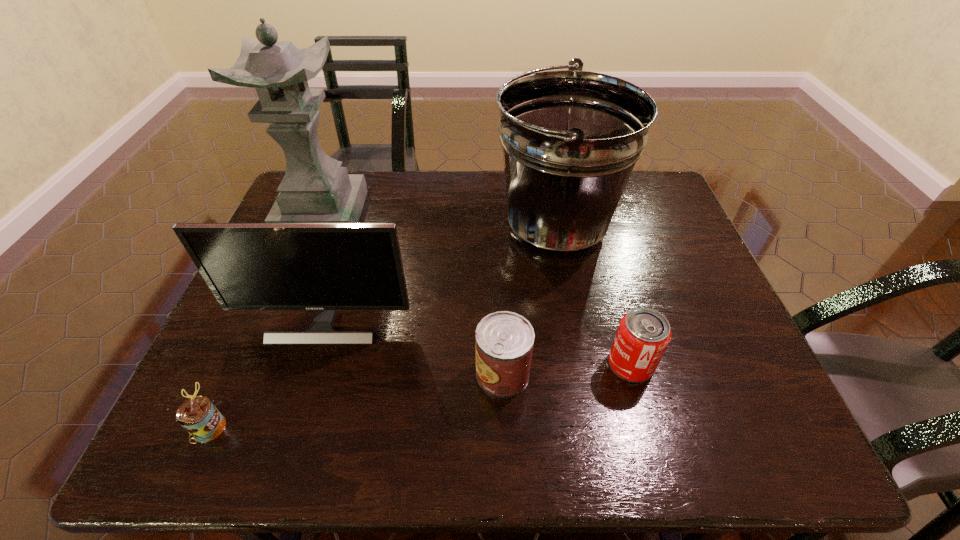
Find the location of a particular element. This screenshot has width=960, height=540. free region located on the screen side of the third tallest object is located at coordinates (301, 395).

The image size is (960, 540). I want to click on vacant space located on the back of the rightmost can, so click(x=603, y=263).

This screenshot has width=960, height=540. In order to click on vacant area located 0.390m on the back of the second can from right to left in this screenshot , I will do `click(497, 238)`.

Where is `vacant area situated on the back of the shortest can`? vacant area situated on the back of the shortest can is located at coordinates (247, 342).

At what (x,y) coordinates should I click in order to perform the action: click on sculpture that is at the far edge. Please return your answer as a coordinate pair (x, y). Looking at the image, I should click on (315, 189).

Identify the location of bucket that is at the far edge. (570, 138).

You are a GUI agent. You are given a task and a screenshot of the screen. Output one action in this format:
    pyautogui.click(x=<x>, y=<y>)
    Task: Click on the object present at the near edge
    
    Given the screenshot: What is the action you would take?
    pyautogui.click(x=198, y=416)

The height and width of the screenshot is (540, 960). Find the location of `sculpture located in the left edge section of the desktop`. sculpture located in the left edge section of the desktop is located at coordinates (315, 189).

Where is `monitor located at the left edge`? monitor located at the left edge is located at coordinates (326, 267).

Where is `can that is at the left edge`? can that is at the left edge is located at coordinates (198, 416).